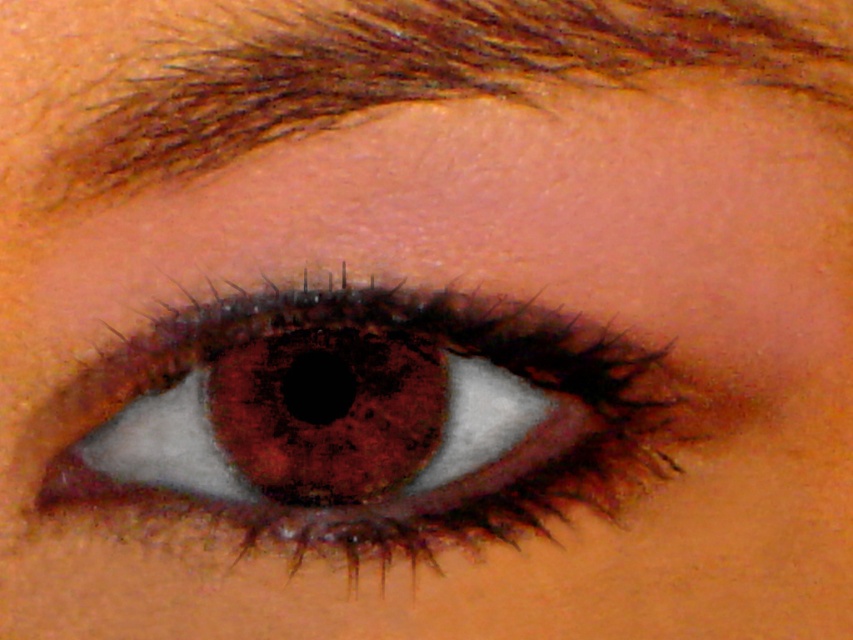
You are an artist sketching this eye and need to ensure proportions are accurate. Given the brown matte eye at center and the brown hair at upper center, which one is narrower in width?

The brown matte eye at center has a lesser width compared to the brown hair at upper center, so the brown matte eye at center is narrower in width.

From the picture: You are a makeup artist preparing to apply eyeliner to the brown matte eye at center. The client has requested that the eyeliner should not touch the brown hair at upper center. Based on the image, is this possible?

The brown matte eye at center is located below the brown hair at upper center, so there is space between them. Therefore, it is possible to apply eyeliner to the brown matte eye at center without touching the brown hair at upper center.

You are a photographer adjusting your camera settings to capture the brown matte eye at center. The camera has a focus point at coordinates point [357,422]. Based on the scene description, where should you position the focus point to ensure the eye is in sharp focus?

The point [357,422] indicates the brown matte eye at center, so positioning the focus point at coordinates point [357,422] will ensure the eye is in sharp focus.